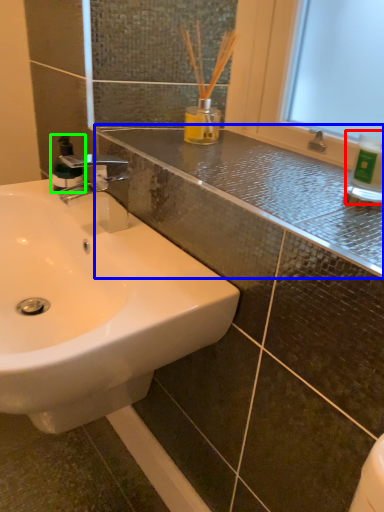
Question: Considering the real-world distances, which object is closest to bottle (highlighted by a red box)? counter top (highlighted by a blue box) or mouthwash (highlighted by a green box).

Choices:
 (A) counter top
 (B) mouthwash

Answer: (A)